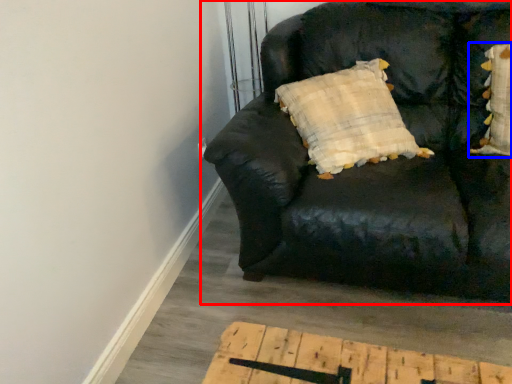
Question: Which point is closer to the camera, studio couch (highlighted by a red box) or pillow (highlighted by a blue box)?

Choices:
 (A) studio couch
 (B) pillow

Answer: (A)